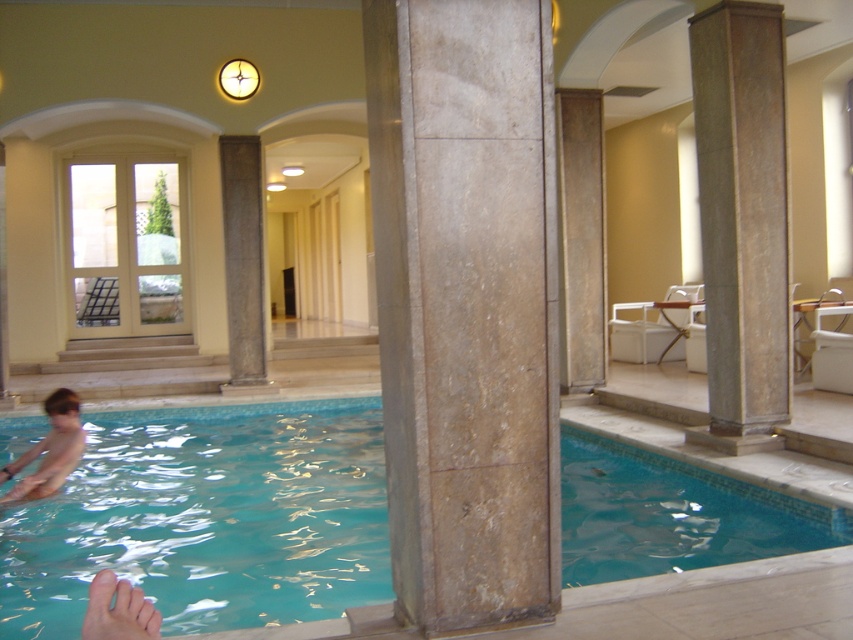
Question: Where is brown stone column at center located in relation to smooth skin foot at lower left in the image?

Choices:
 (A) above
 (B) below

Answer: (A)

Question: Which point is farther to the camera?

Choices:
 (A) light brown skin at lower left
 (B) brown stone column at center

Answer: (B)

Question: Which of the following is the farthest from the observer?

Choices:
 (A) (137, 433)
 (B) (245, 253)

Answer: (B)

Question: Is smooth stone column at center bigger than light brown skin at lower left?

Choices:
 (A) no
 (B) yes

Answer: (B)

Question: Can you confirm if light brown skin at lower left is positioned to the left of smooth skin foot at lower left?

Choices:
 (A) yes
 (B) no

Answer: (A)

Question: Which of the following is the closest to the observer?

Choices:
 (A) smooth stone column at center
 (B) brown stone column at center
 (C) light brown skin at lower left

Answer: (C)